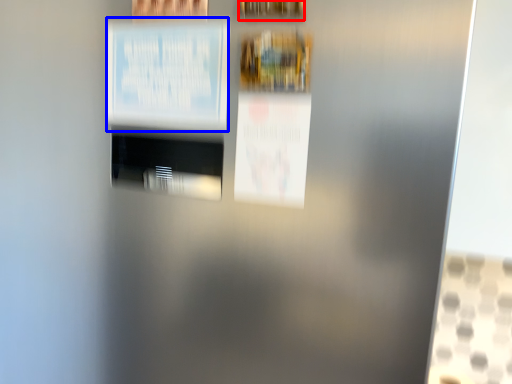
Question: Which of the following is the closest to the observer, picture frame (highlighted by a red box) or poster (highlighted by a blue box)?

Choices:
 (A) picture frame
 (B) poster

Answer: (A)